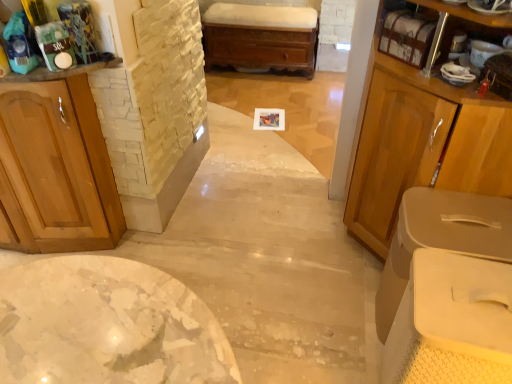
Question: Does wooden cabinet at left, which is the first cabinetry from left to right, turn towards beige plastic bins at right, which is counted as the 1th cabinetry, starting from the right?

Choices:
 (A) no
 (B) yes

Answer: (A)

Question: Is wooden cabinet at left, arranged as the third cabinetry when viewed from the right, further to camera compared to beige plastic bins at right, the 3th cabinetry positioned from the left?

Choices:
 (A) yes
 (B) no

Answer: (B)

Question: Is wooden cabinet at left, arranged as the third cabinetry when viewed from the right, positioned in front of beige plastic bins at right, which is counted as the 1th cabinetry, starting from the right?

Choices:
 (A) yes
 (B) no

Answer: (A)

Question: From a real-world perspective, is wooden cabinet at left, which is the first cabinetry from left to right, positioned over beige plastic bins at right, which is counted as the 1th cabinetry, starting from the right, based on gravity?

Choices:
 (A) yes
 (B) no

Answer: (A)

Question: Would you say wooden cabinet at left, which is the first cabinetry from left to right, contains beige plastic bins at right, which is counted as the 1th cabinetry, starting from the right?

Choices:
 (A) no
 (B) yes

Answer: (A)

Question: Does wooden cabinet at left, arranged as the third cabinetry when viewed from the right, have a lesser height compared to beige plastic bins at right, the 3th cabinetry positioned from the left?

Choices:
 (A) yes
 (B) no

Answer: (B)

Question: Is wooden shelf at upper right to the left of beige plastic bins at right, the 3th cabinetry positioned from the left, from the viewer's perspective?

Choices:
 (A) yes
 (B) no

Answer: (A)

Question: Does wooden shelf at upper right have a greater height compared to beige plastic bins at right, which is counted as the 1th cabinetry, starting from the right?

Choices:
 (A) no
 (B) yes

Answer: (A)

Question: Is wooden shelf at upper right closer to the viewer compared to beige plastic bins at right, which is counted as the 1th cabinetry, starting from the right?

Choices:
 (A) no
 (B) yes

Answer: (A)

Question: From the image's perspective, is wooden shelf at upper right on top of beige plastic bins at right, which is counted as the 1th cabinetry, starting from the right?

Choices:
 (A) no
 (B) yes

Answer: (B)

Question: Is the surface of wooden shelf at upper right in direct contact with beige plastic bins at right, which is counted as the 1th cabinetry, starting from the right?

Choices:
 (A) no
 (B) yes

Answer: (A)

Question: Can you confirm if wooden shelf at upper right is bigger than beige plastic bins at right, which is counted as the 1th cabinetry, starting from the right?

Choices:
 (A) no
 (B) yes

Answer: (A)

Question: From the image's perspective, is wooden cabinet at left, arranged as the third cabinetry when viewed from the right, under matte wood cabinet at right, the 2th cabinetry positioned from the right?

Choices:
 (A) yes
 (B) no

Answer: (B)